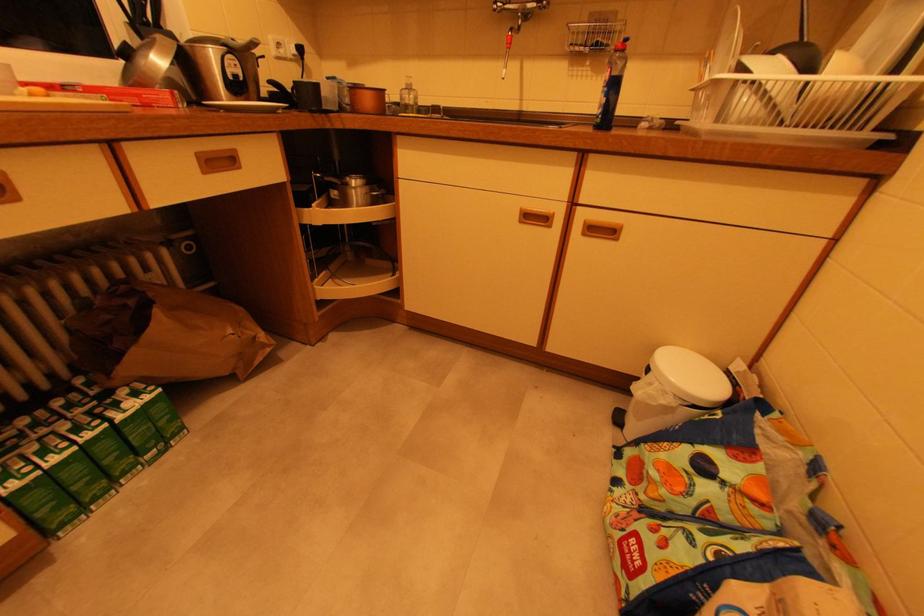
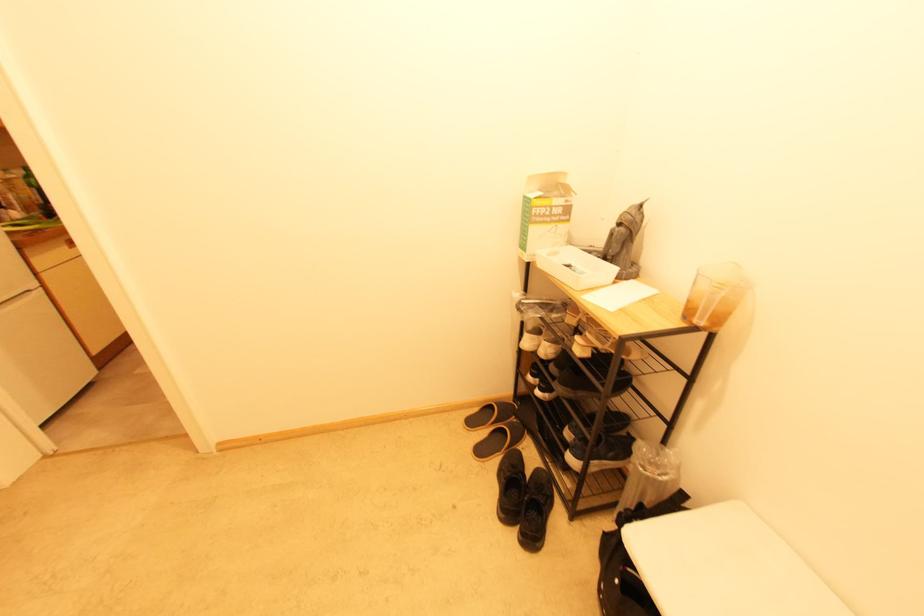
Question: I am providing you with two images of the same scene from different viewpoints. After the viewpoint changes to image2, which objects are now occluded?

Choices:
 (A) small clear glass
 (B) plastic liquid container
 (C) metal pot handle
 (D) black sneaker

Answer: (C)